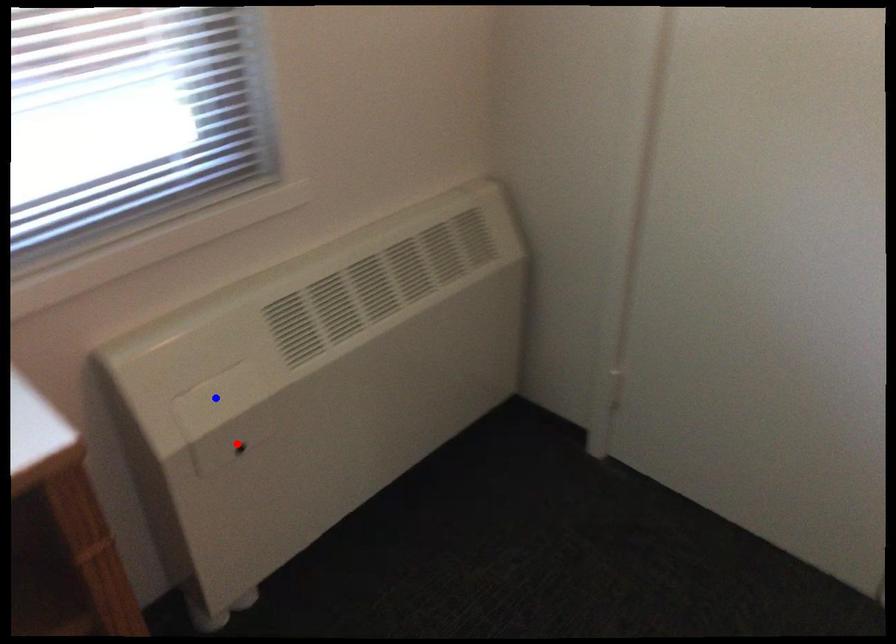
Question: Which of the two points in the image is closer to the camera?

Choices:
 (A) Blue point is closer.
 (B) Red point is closer.

Answer: (A)